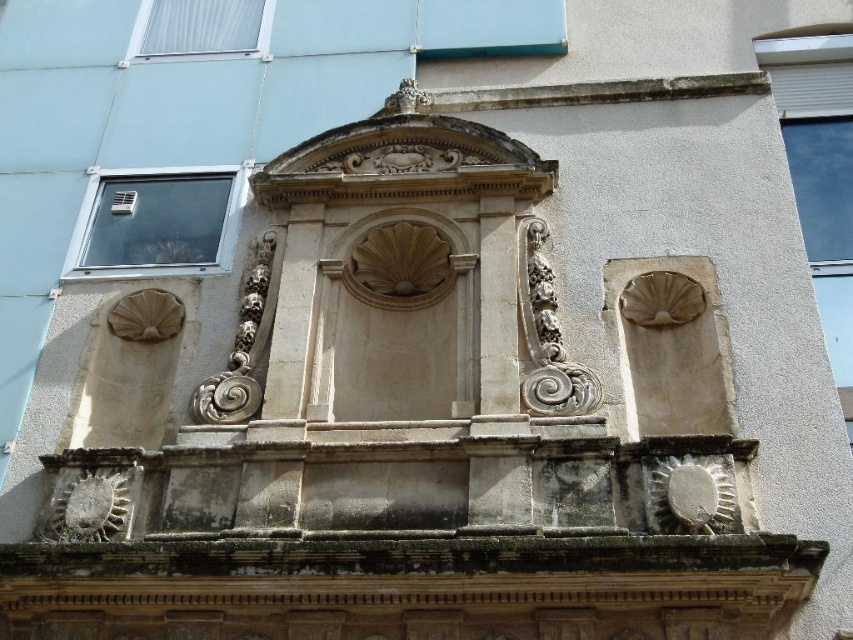
You are an architect examining the building facade and need to determine the best point to install a small decorative light. The two points available are point (x=112, y=189) and point (x=178, y=22). Which point is closer to the viewer and thus more suitable for visibility?

Point (x=112, y=189) is closer to the viewer than point (x=178, y=22), making it more suitable for visibility as a decorative light installation point.

You are an architect examining the building facade. You notice two windows at the upper left corner. Which window is positioned lower between the transparent glass window at upper left and the white plastic window at upper left?

The transparent glass window at upper left is located below the white plastic window at upper left, so the transparent glass window at upper left is positioned lower.